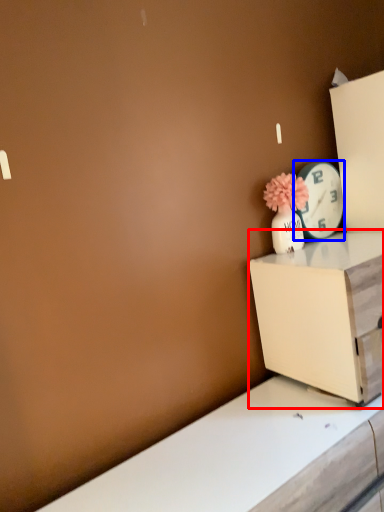
Question: Which object appears farthest to the camera in this image, nightstand (highlighted by a red box) or clock (highlighted by a blue box)?

Choices:
 (A) nightstand
 (B) clock

Answer: (B)